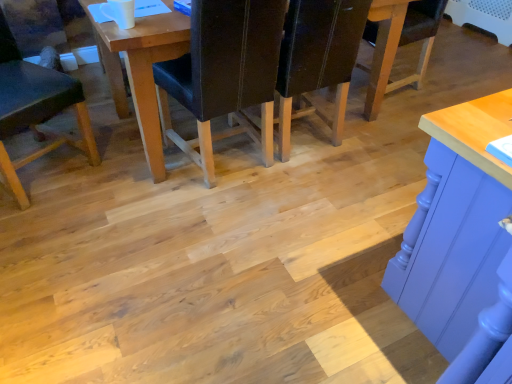
This screenshot has height=384, width=512. I want to click on vacant area that lies in front of black leather chair at center, marked as the 2th chair in a right-to-left arrangement, so (221, 226).